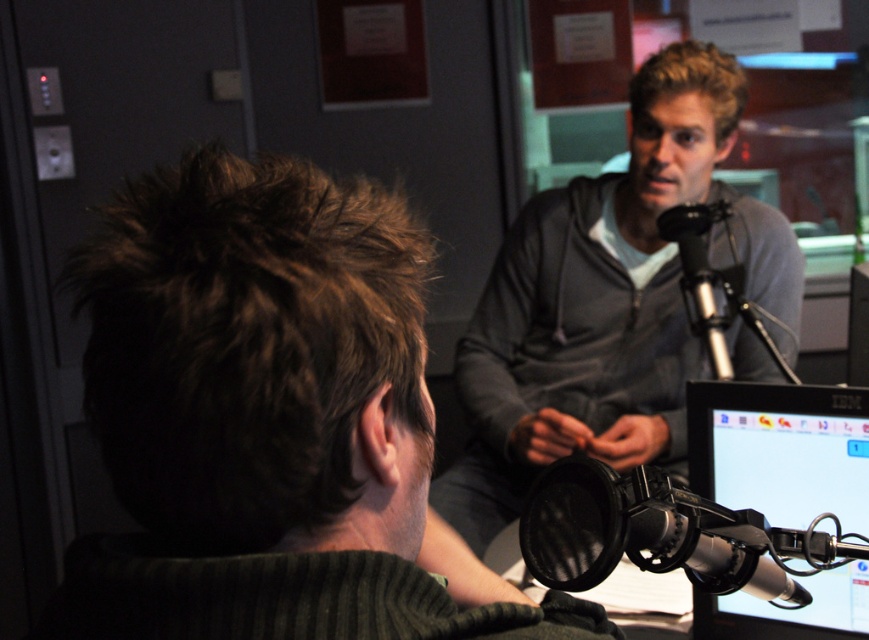
Between black glossy monitor at lower right and black mesh microphone at center, which one appears on the right side from the viewer's perspective?

black glossy monitor at lower right

Which is in front, point (761, 384) or point (549, 476)?

Point (549, 476)

This screenshot has height=640, width=869. What do you see at coordinates (780, 449) in the screenshot? I see `black glossy monitor at lower right` at bounding box center [780, 449].

You are a GUI agent. You are given a task and a screenshot of the screen. Output one action in this format:
    pyautogui.click(x=<x>, y=<y>)
    Task: Click on the black glossy monitor at lower right
    
    Given the screenshot: What is the action you would take?
    pyautogui.click(x=780, y=449)

Does point (687, 321) lie in front of point (717, 314)?

Yes, point (687, 321) is closer to viewer.

Which is in front, point (542, 237) or point (694, 275)?

Point (694, 275) is more forward.

Does point (629, 221) come closer to viewer compared to point (713, 372)?

No, (629, 221) is behind (713, 372).

This screenshot has height=640, width=869. Identify the location of gray zip-up hoodie at upper center. (608, 301).

Which of these two, black mesh microphone at center or black metallic microphone at center, stands shorter?

A: black mesh microphone at center is shorter.

Does black mesh microphone at center have a greater width compared to black metallic microphone at center?

Yes.

The width and height of the screenshot is (869, 640). I want to click on black mesh microphone at center, so click(642, 532).